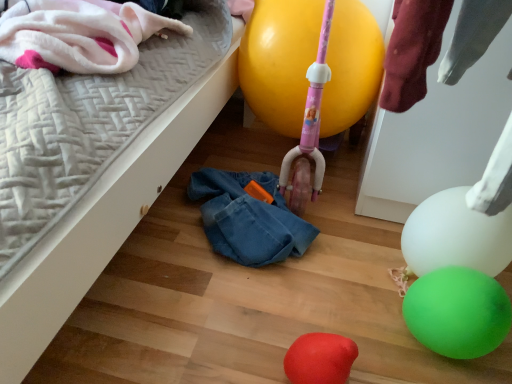
You are a GUI agent. You are given a task and a screenshot of the screen. Output one action in this format:
    pyautogui.click(x=<x>, y=<y>)
    Task: Click on the vacant space behind rubber balloon at lower center, which is the fourth balloon from top to bottom
    The height and width of the screenshot is (384, 512).
    Given the screenshot: What is the action you would take?
    pyautogui.click(x=311, y=320)